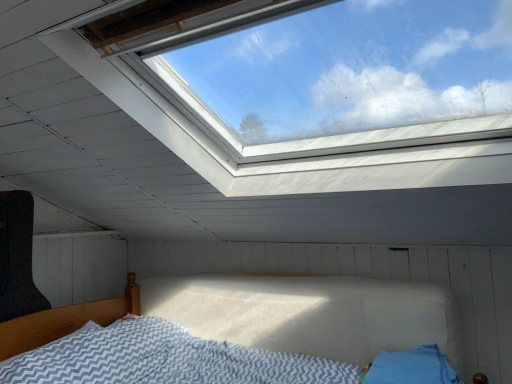
The height and width of the screenshot is (384, 512). What do you see at coordinates (412, 367) in the screenshot?
I see `blue fabric pillow at lower right` at bounding box center [412, 367].

Find the location of a particular element. Image resolution: width=512 pixels, height=384 pixels. blue fabric pillow at lower right is located at coordinates (412, 367).

I want to click on blue fabric pillow at lower right, so click(412, 367).